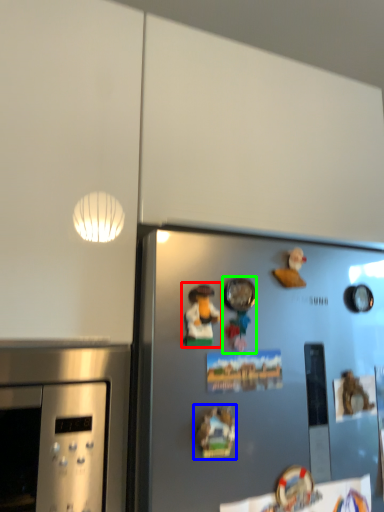
Question: Which object is the closest to the art (highlighted by a red box)? Choose among these: art (highlighted by a blue box) or toy (highlighted by a green box).

Choices:
 (A) art
 (B) toy

Answer: (B)